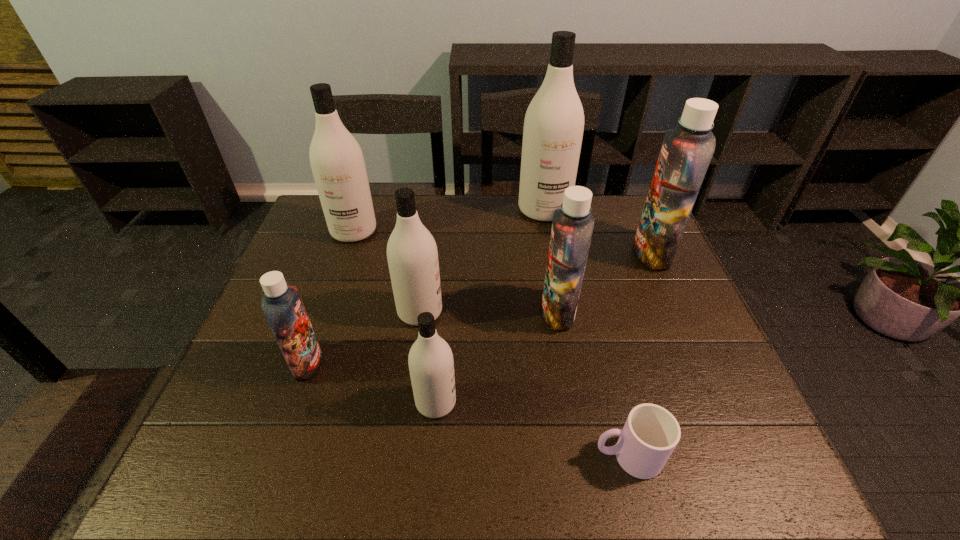
This screenshot has width=960, height=540. Find the location of `blank space located 0.240m on the front label of the second nearest blue shampoo`. blank space located 0.240m on the front label of the second nearest blue shampoo is located at coordinates (448, 312).

The image size is (960, 540). I want to click on vacant area situated on the front-facing side of the second nearest white shampoo, so click(x=540, y=312).

This screenshot has width=960, height=540. Find the location of `vacant region located on the front label of the leftmost blue shampoo`. vacant region located on the front label of the leftmost blue shampoo is located at coordinates (395, 363).

Locate an element on the screen. free location located on the front-facing side of the nearest white shampoo is located at coordinates 633,402.

At what (x,y) coordinates should I click in order to perform the action: click on free spot located with the handle on the side of the cup. Please return your answer as a coordinate pair (x, y). The width and height of the screenshot is (960, 540). Looking at the image, I should click on (455, 456).

Find the location of a particular element. vacant space located 0.160m with the handle on the side of the cup is located at coordinates (512, 456).

Where is `vacant space situated 0.090m with the handle on the side of the cup`? The image size is (960, 540). vacant space situated 0.090m with the handle on the side of the cup is located at coordinates (547, 456).

Locate an element on the screen. The width and height of the screenshot is (960, 540). object that is at the near edge is located at coordinates (650, 434).

Where is `object that is at the right edge`? The height and width of the screenshot is (540, 960). object that is at the right edge is located at coordinates (686, 152).

Find the location of a particular element. object present at the far left corner is located at coordinates (336, 159).